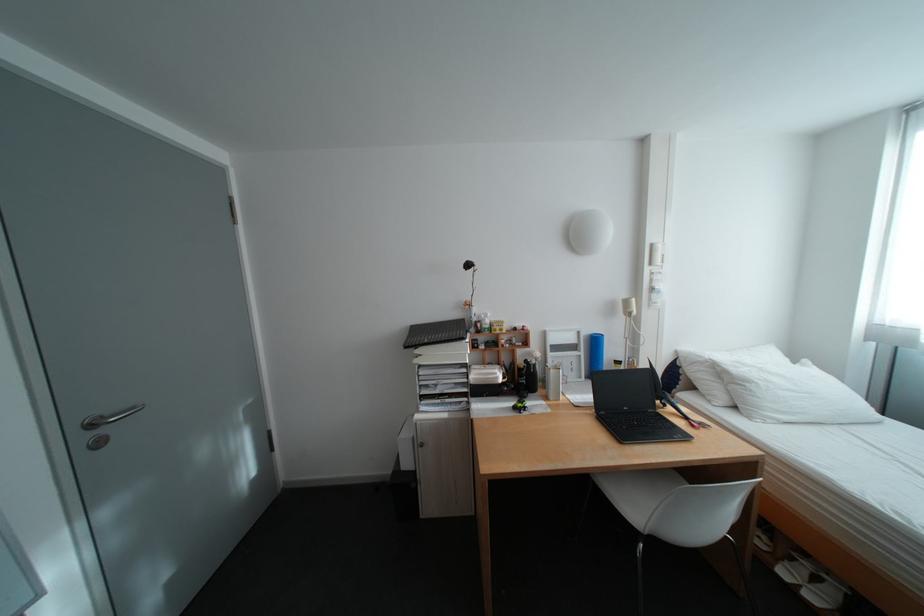
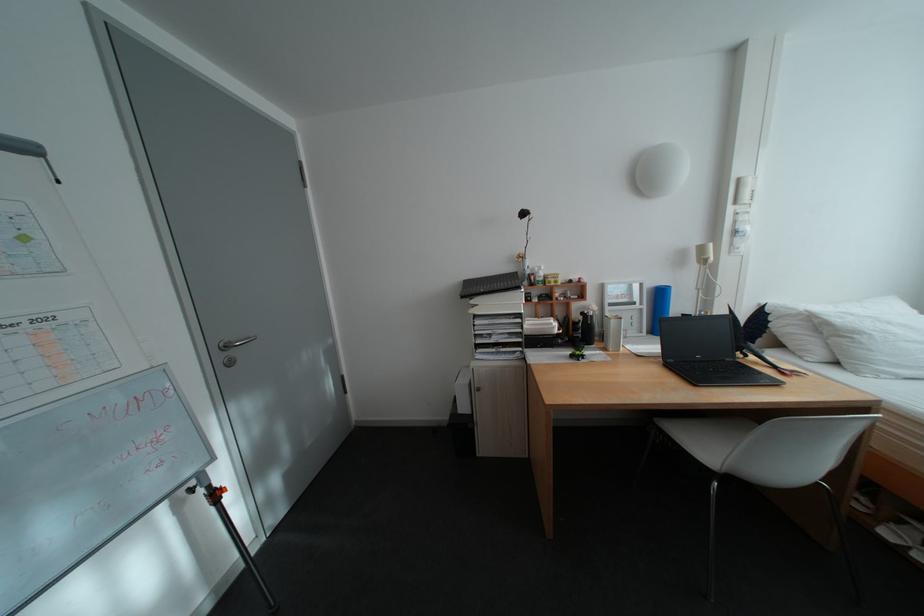
Question: The camera is either moving clockwise (left) or counter-clockwise (right) around the object. The first image is from the beginning of the video and the second image is from the end. Is the camera moving left or right when shooting the video?

Choices:
 (A) Left
 (B) Right

Answer: (B)